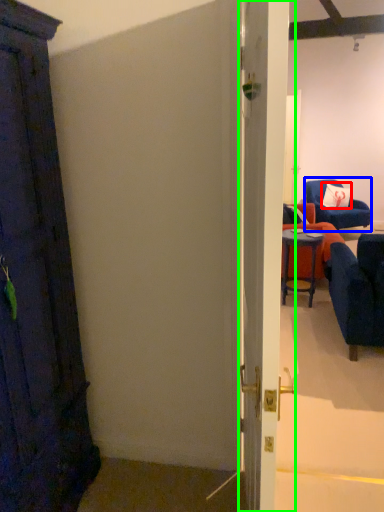
Question: Which object is positioned closest to pillow (highlighted by a red box)? Select from chair (highlighted by a blue box) and door (highlighted by a green box).

Choices:
 (A) chair
 (B) door

Answer: (A)